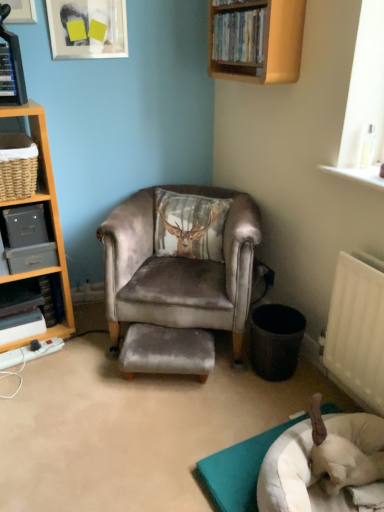
Question: Considering the relative sizes of wooden shelf at upper center, the 4th shelf positioned from the bottom, and black plastic trash can at lower right in the image provided, is wooden shelf at upper center, the 4th shelf positioned from the bottom, thinner than black plastic trash can at lower right?

Choices:
 (A) no
 (B) yes

Answer: (B)

Question: Considering the relative positions of wooden shelf at upper center, the 4th shelf positioned from the bottom, and black plastic trash can at lower right in the image provided, is wooden shelf at upper center, the 4th shelf positioned from the bottom, to the left of black plastic trash can at lower right from the viewer's perspective?

Choices:
 (A) yes
 (B) no

Answer: (A)

Question: Considering the relative sizes of wooden shelf at upper center, marked as the 4th shelf in a left-to-right arrangement, and black plastic trash can at lower right in the image provided, is wooden shelf at upper center, marked as the 4th shelf in a left-to-right arrangement, wider than black plastic trash can at lower right?

Choices:
 (A) no
 (B) yes

Answer: (A)

Question: Considering the relative sizes of wooden shelf at upper center, marked as the 4th shelf in a left-to-right arrangement, and black plastic trash can at lower right in the image provided, is wooden shelf at upper center, marked as the 4th shelf in a left-to-right arrangement, smaller than black plastic trash can at lower right?

Choices:
 (A) yes
 (B) no

Answer: (B)

Question: Are wooden shelf at upper center, marked as the 4th shelf in a left-to-right arrangement, and black plastic trash can at lower right beside each other?

Choices:
 (A) no
 (B) yes

Answer: (A)

Question: Is wooden shelf at upper center, the 1th shelf in the right-to-left sequence, oriented towards black plastic trash can at lower right?

Choices:
 (A) no
 (B) yes

Answer: (A)

Question: From a real-world perspective, is white fabric dog bed at lower right physically below metallic gray file cabinet at left, the second shelf ordered from the bottom?

Choices:
 (A) yes
 (B) no

Answer: (A)

Question: Does white fabric dog bed at lower right have a greater height compared to metallic gray file cabinet at left, which is the 3th shelf in top-to-bottom order?

Choices:
 (A) no
 (B) yes

Answer: (A)

Question: Is white fabric dog bed at lower right positioned far away from metallic gray file cabinet at left, the second shelf when ordered from left to right?

Choices:
 (A) yes
 (B) no

Answer: (A)

Question: Is the surface of white fabric dog bed at lower right in direct contact with metallic gray file cabinet at left, the second shelf ordered from the bottom?

Choices:
 (A) yes
 (B) no

Answer: (B)

Question: Considering the relative positions of white fabric dog bed at lower right and metallic gray file cabinet at left, the second shelf ordered from the bottom, in the image provided, is white fabric dog bed at lower right to the left of metallic gray file cabinet at left, the second shelf ordered from the bottom, from the viewer's perspective?

Choices:
 (A) no
 (B) yes

Answer: (A)

Question: Is white fabric dog bed at lower right completely or partially outside of metallic gray file cabinet at left, which is the 3th shelf in top-to-bottom order?

Choices:
 (A) no
 (B) yes

Answer: (B)

Question: Considering the relative sizes of woven brown basket at left, positioned as the 3th shelf in bottom-to-top order, and black plastic trash can at lower right in the image provided, is woven brown basket at left, positioned as the 3th shelf in bottom-to-top order, wider than black plastic trash can at lower right?

Choices:
 (A) yes
 (B) no

Answer: (A)